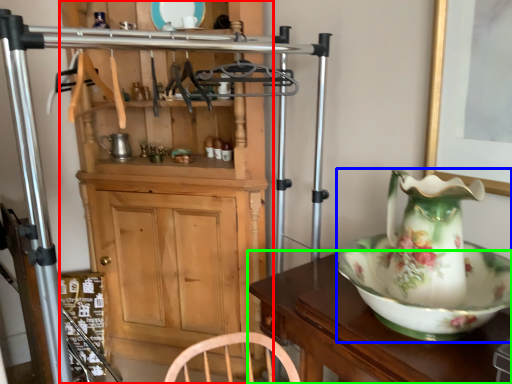
Question: Estimate the real-world distances between objects in this image. Which object is farther from cabinetry (highlighted by a red box), jug (highlighted by a blue box) or table (highlighted by a green box)?

Choices:
 (A) jug
 (B) table

Answer: (A)